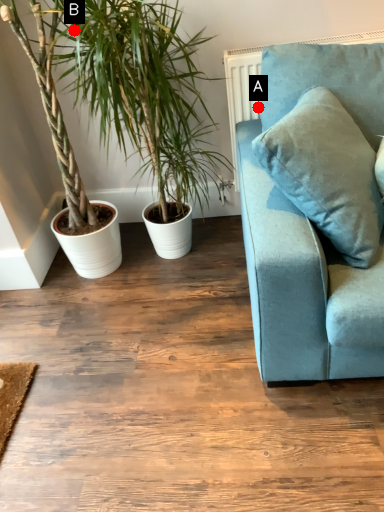
Question: Two points are circled on the image, labeled by A and B beside each circle. Which point is farther to the camera?

Choices:
 (A) A is further
 (B) B is further

Answer: (B)